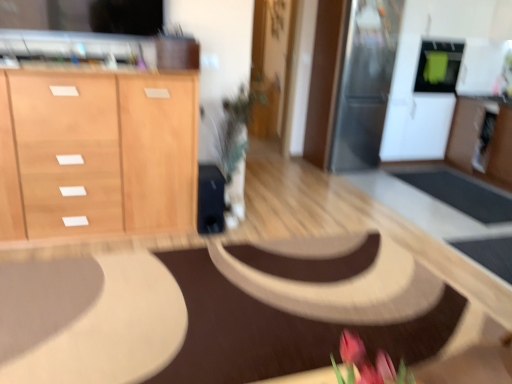
Question: Choose the correct answer: Is light wood cabinet at left inside brown fabric mat at center or outside it?

Choices:
 (A) outside
 (B) inside

Answer: (A)

Question: From the image's perspective, is light wood cabinet at left located above or below brown fabric mat at center?

Choices:
 (A) above
 (B) below

Answer: (A)

Question: Which object is the closest to the green matte microwave at upper right, the 2th appliance positioned from the left?

Choices:
 (A) light wood cabinet at left
 (B) brown fabric mat at center
 (C) sleek stainless steel refrigerator at upper right, the 1th appliance viewed from the left

Answer: (C)

Question: Which object is the farthest from the sleek stainless steel refrigerator at upper right, the 1th appliance viewed from the left?

Choices:
 (A) brown fabric mat at center
 (B) light wood cabinet at left
 (C) green matte microwave at upper right, arranged as the 1th appliance when viewed from the right

Answer: (B)